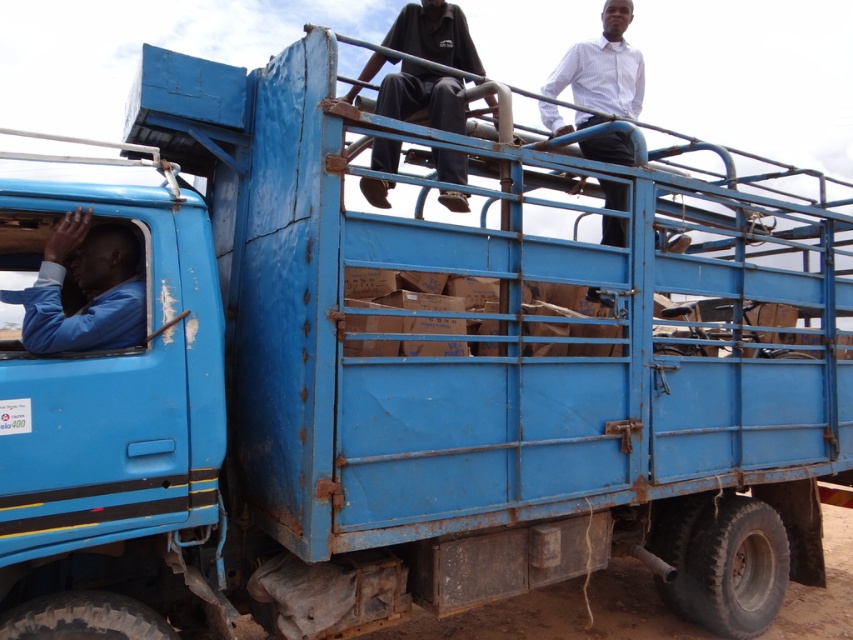
Question: Which point is farther from the camera taking this photo?

Choices:
 (A) (39, 301)
 (B) (402, 49)

Answer: (B)

Question: Which object is closer to the camera taking this photo?

Choices:
 (A) dark blue shirt at upper center
 (B) blue matte shirt at left

Answer: (B)

Question: Is blue matte shirt at left in front of dark blue shirt at upper center?

Choices:
 (A) yes
 (B) no

Answer: (A)

Question: Is blue matte shirt at left above dark blue shirt at upper center?

Choices:
 (A) yes
 (B) no

Answer: (B)

Question: Which point is closer to the camera?

Choices:
 (A) dark blue shirt at upper center
 (B) blue matte shirt at left

Answer: (B)

Question: Can you confirm if blue matte shirt at left is positioned above dark blue shirt at upper center?

Choices:
 (A) no
 (B) yes

Answer: (A)